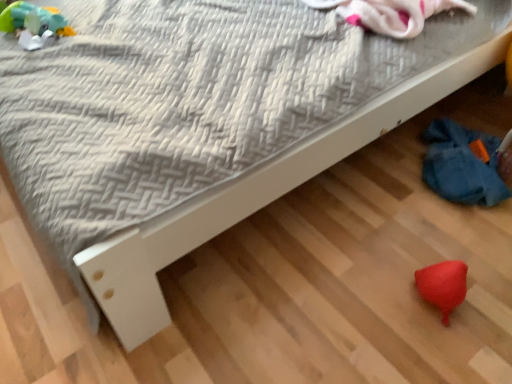
Question: Should I look upward or downward to see rubberized green and yellow toy at upper left?

Choices:
 (A) up
 (B) down

Answer: (A)